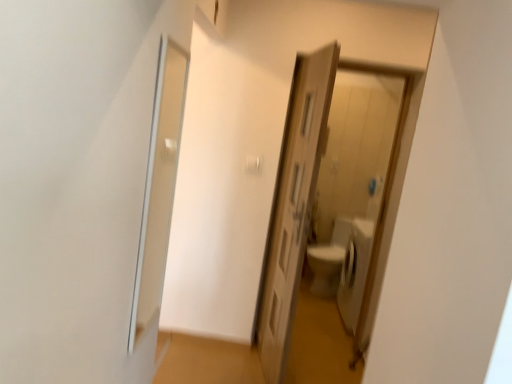
Question: Can you confirm if wooden door at center is wider than white glossy toilet at center, marked as the second path in a front-to-back arrangement?

Choices:
 (A) no
 (B) yes

Answer: (A)

Question: Is wooden door at center positioned beyond the bounds of white glossy toilet at center, acting as the 1th path starting from the back?

Choices:
 (A) yes
 (B) no

Answer: (A)

Question: Does wooden door at center come behind white glossy toilet at center, marked as the second path in a front-to-back arrangement?

Choices:
 (A) no
 (B) yes

Answer: (A)

Question: From a real-world perspective, is wooden door at center beneath white glossy toilet at center, marked as the second path in a front-to-back arrangement?

Choices:
 (A) no
 (B) yes

Answer: (A)

Question: Can you confirm if wooden door at center is bigger than white glossy toilet at center, acting as the 1th path starting from the back?

Choices:
 (A) no
 (B) yes

Answer: (B)

Question: Is transparent glass screen door at left taller or shorter than brown wooden door at center, which is the second path from back to front?

Choices:
 (A) short
 (B) tall

Answer: (B)

Question: From a real-world perspective, is transparent glass screen door at left positioned above or below brown wooden door at center, the first path when ordered from front to back?

Choices:
 (A) above
 (B) below

Answer: (A)

Question: From the image's perspective, is transparent glass screen door at left positioned above or below brown wooden door at center, which is the second path from back to front?

Choices:
 (A) above
 (B) below

Answer: (A)

Question: Is transparent glass screen door at left in front of or behind brown wooden door at center, which is the second path from back to front, in the image?

Choices:
 (A) front
 (B) behind

Answer: (A)

Question: In terms of height, does brown wooden door at center, the first path when ordered from front to back, look taller or shorter compared to transparent glass screen door at left?

Choices:
 (A) tall
 (B) short

Answer: (B)

Question: Is brown wooden door at center, the first path when ordered from front to back, in front of or behind transparent glass screen door at left in the image?

Choices:
 (A) behind
 (B) front

Answer: (A)

Question: In terms of width, does brown wooden door at center, the first path when ordered from front to back, look wider or thinner when compared to transparent glass screen door at left?

Choices:
 (A) wide
 (B) thin

Answer: (A)

Question: Considering the positions of point (232, 349) and point (177, 67), is point (232, 349) closer or farther from the camera than point (177, 67)?

Choices:
 (A) farther
 (B) closer

Answer: (A)

Question: Is wooden door at center bigger or smaller than brown wooden door at center, which is the second path from back to front?

Choices:
 (A) small
 (B) big

Answer: (B)

Question: Relative to brown wooden door at center, which is the second path from back to front, is wooden door at center in front or behind?

Choices:
 (A) front
 (B) behind

Answer: (A)